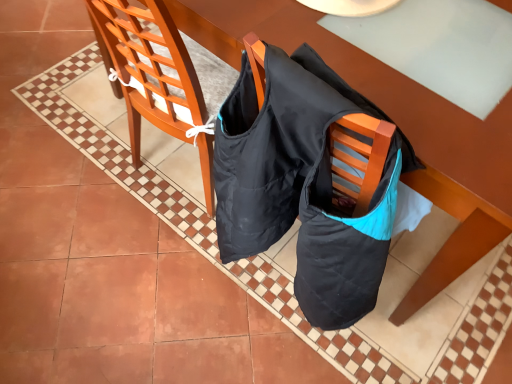
This screenshot has width=512, height=384. Identify the location of free spot below matte wood chair at left (from a real-world perspective). (170, 175).